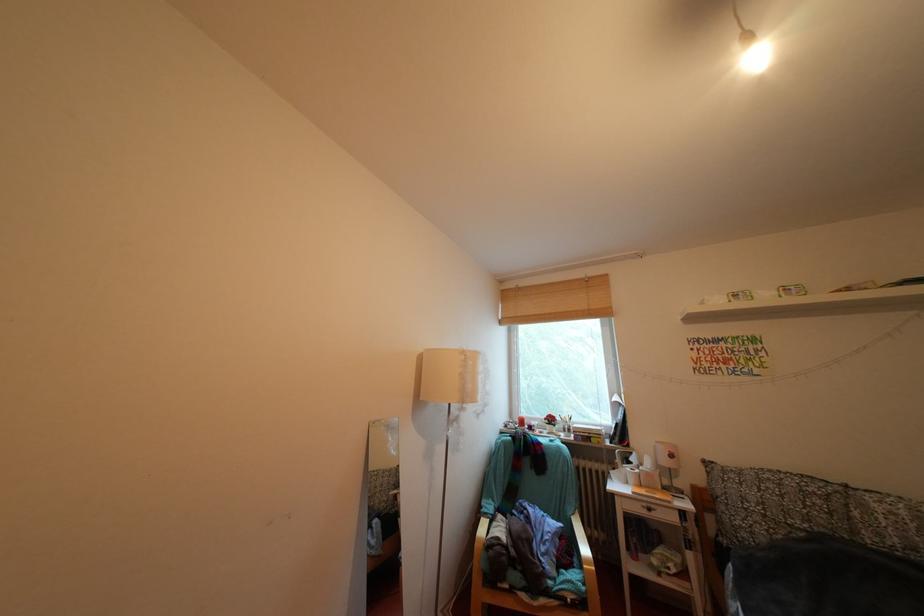
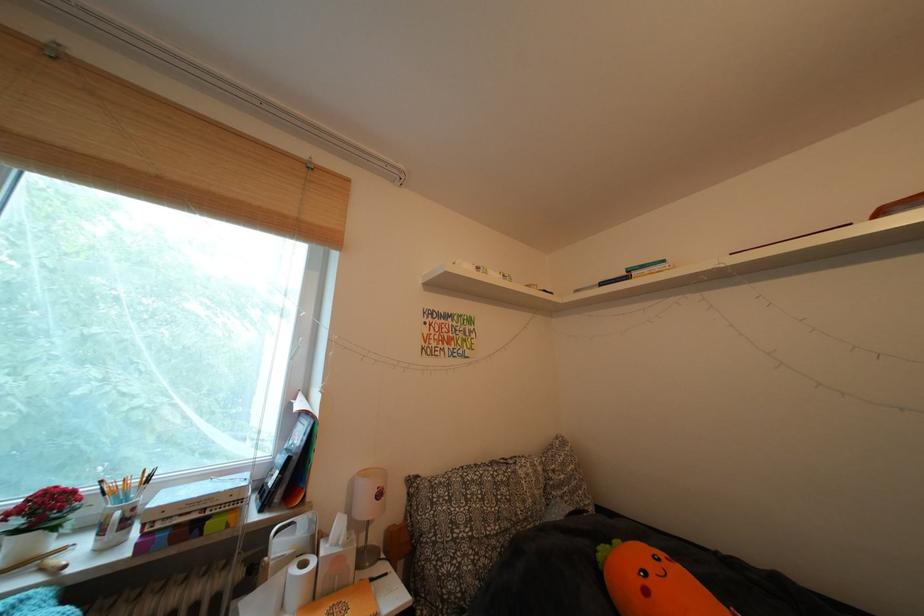
Find the pixel in the second image that matches [659,480] in the first image.

(346, 565)